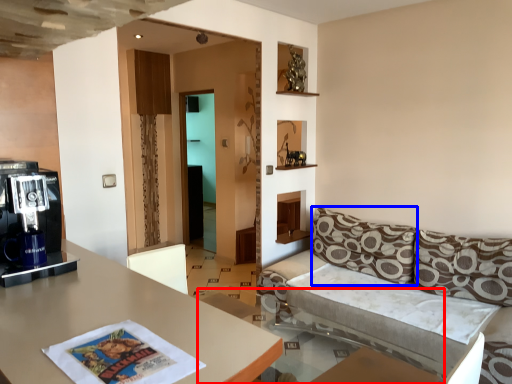
Question: Which object appears closest to the camera in this image, glass table (highlighted by a red box) or pillow (highlighted by a blue box)?

Choices:
 (A) glass table
 (B) pillow

Answer: (A)